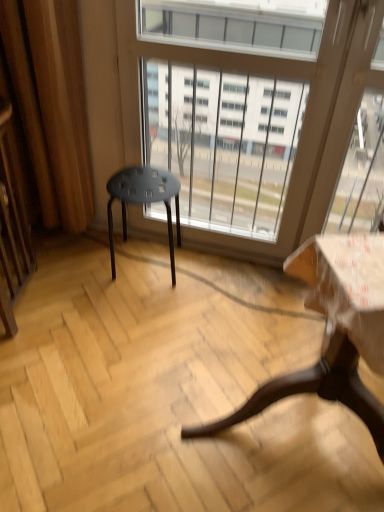
Question: Would you say wooden table at lower right contains matte black stool at center?

Choices:
 (A) yes
 (B) no

Answer: (B)

Question: Is the surface of wooden table at lower right in direct contact with matte black stool at center?

Choices:
 (A) yes
 (B) no

Answer: (B)

Question: Can you confirm if wooden table at lower right is taller than matte black stool at center?

Choices:
 (A) yes
 (B) no

Answer: (A)

Question: Is wooden table at lower right bigger than matte black stool at center?

Choices:
 (A) no
 (B) yes

Answer: (B)

Question: From a real-world perspective, is wooden table at lower right beneath matte black stool at center?

Choices:
 (A) yes
 (B) no

Answer: (B)

Question: Is wooden screen door at left to the left or to the right of wooden table at lower right in the image?

Choices:
 (A) right
 (B) left

Answer: (B)

Question: Is point (6, 177) positioned closer to the camera than point (297, 266)?

Choices:
 (A) closer
 (B) farther

Answer: (B)

Question: In terms of width, does wooden screen door at left look wider or thinner when compared to wooden table at lower right?

Choices:
 (A) wide
 (B) thin

Answer: (B)

Question: Considering their positions, is wooden screen door at left located in front of or behind wooden table at lower right?

Choices:
 (A) behind
 (B) front

Answer: (A)

Question: Considering the positions of matte black stool at center and transparent glass window at center in the image, is matte black stool at center bigger or smaller than transparent glass window at center?

Choices:
 (A) small
 (B) big

Answer: (A)

Question: Which is correct: matte black stool at center is inside transparent glass window at center, or outside of it?

Choices:
 (A) inside
 (B) outside

Answer: (B)

Question: Is matte black stool at center to the left or to the right of transparent glass window at center in the image?

Choices:
 (A) left
 (B) right

Answer: (A)

Question: Considering the positions of matte black stool at center and transparent glass window at center in the image, is matte black stool at center taller or shorter than transparent glass window at center?

Choices:
 (A) tall
 (B) short

Answer: (B)

Question: From a real-world perspective, relative to matte black stool at center, is transparent glass window at center vertically above or below?

Choices:
 (A) below
 (B) above

Answer: (B)

Question: Relative to matte black stool at center, is transparent glass window at center in front or behind?

Choices:
 (A) behind
 (B) front

Answer: (B)